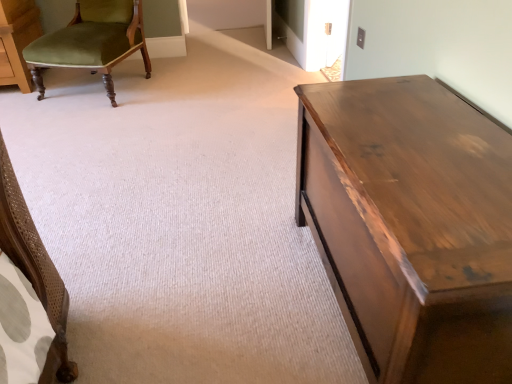
In order to click on free space to the right of green velvet chair at upper left in this screenshot , I will do `click(189, 82)`.